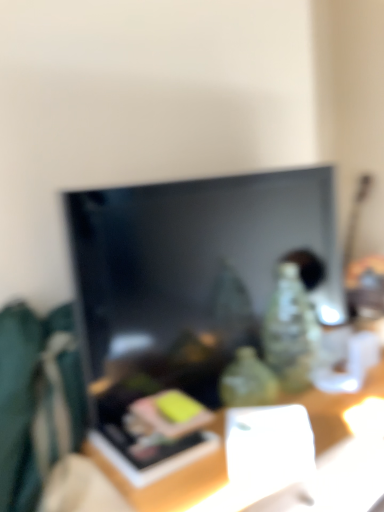
Question: Should I look upward or downward to see wooden table at center?

Choices:
 (A) up
 (B) down

Answer: (B)

Question: Considering the relative sizes of wooden table at center and black glossy tv at center in the image provided, is wooden table at center taller than black glossy tv at center?

Choices:
 (A) yes
 (B) no

Answer: (B)

Question: Does wooden table at center have a smaller size compared to black glossy tv at center?

Choices:
 (A) no
 (B) yes

Answer: (A)

Question: Can you confirm if wooden table at center is shorter than black glossy tv at center?

Choices:
 (A) no
 (B) yes

Answer: (B)

Question: Is wooden table at center facing away from black glossy tv at center?

Choices:
 (A) no
 (B) yes

Answer: (A)

Question: Would you consider wooden table at center to be distant from black glossy tv at center?

Choices:
 (A) no
 (B) yes

Answer: (A)

Question: Considering the relative sizes of wooden table at center and black glossy tv at center in the image provided, is wooden table at center wider than black glossy tv at center?

Choices:
 (A) yes
 (B) no

Answer: (A)

Question: Is black glossy tv at center shorter than wooden table at center?

Choices:
 (A) no
 (B) yes

Answer: (A)

Question: Can you confirm if black glossy tv at center is thinner than wooden table at center?

Choices:
 (A) no
 (B) yes

Answer: (B)

Question: From the image's perspective, is black glossy tv at center located beneath wooden table at center?

Choices:
 (A) no
 (B) yes

Answer: (A)

Question: Does black glossy tv at center have a larger size compared to wooden table at center?

Choices:
 (A) no
 (B) yes

Answer: (A)

Question: Is the position of black glossy tv at center more distant than that of wooden table at center?

Choices:
 (A) yes
 (B) no

Answer: (A)

Question: From a real-world perspective, is black glossy tv at center physically below wooden table at center?

Choices:
 (A) yes
 (B) no

Answer: (B)

Question: Considering their positions, is black glossy tv at center located in front of or behind wooden table at center?

Choices:
 (A) behind
 (B) front

Answer: (A)